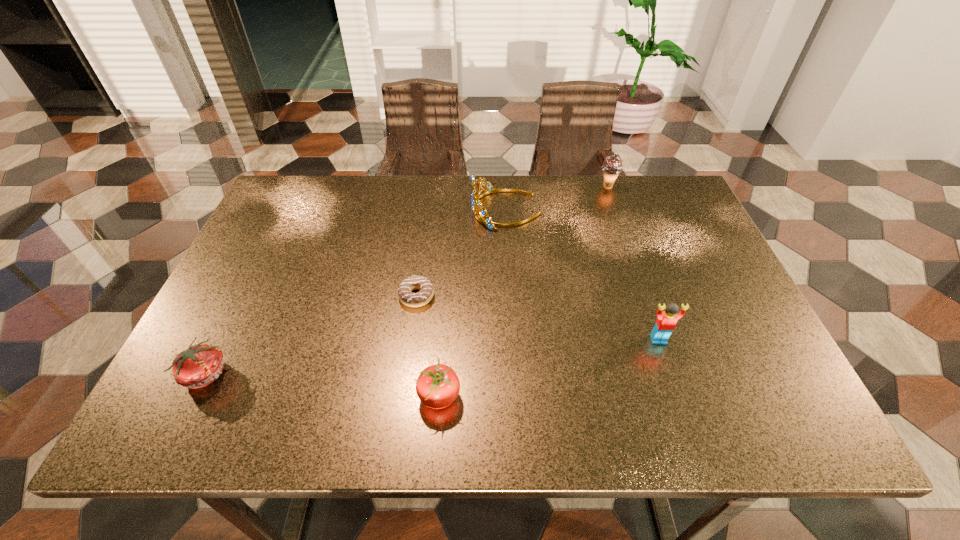
This screenshot has width=960, height=540. Find the location of `free spot located on the front-facing side of the fourth object from left to right`. free spot located on the front-facing side of the fourth object from left to right is located at coordinates (364, 210).

Find the location of a particular element. free location located 0.100m on the face of the Lego is located at coordinates (675, 386).

You are a GUI agent. You are given a task and a screenshot of the screen. Output one action in this format:
    pyautogui.click(x=<x>, y=<y>)
    Task: Click on the vacant point located on the right of the right tomato
    Image resolution: width=960 pixels, height=540 pixels.
    Given the screenshot: What is the action you would take?
    pyautogui.click(x=619, y=396)

The width and height of the screenshot is (960, 540). What are the coordinates of `free region located on the back of the leftmost object` in the screenshot? It's located at (248, 289).

I want to click on free space located on the front of the doughnut, so click(x=405, y=379).

Locate an element on the screen. icecream that is at the far edge is located at coordinates (612, 166).

Where is `tiara present at the far edge`? This screenshot has height=540, width=960. tiara present at the far edge is located at coordinates (482, 217).

Find the location of a particular element. This screenshot has width=960, height=540. object situated at the left edge is located at coordinates (196, 367).

You are a GUI agent. You are given a task and a screenshot of the screen. Output one action in this format:
    pyautogui.click(x=<x>, y=<y>)
    Task: Click on the object that is positioned at the near left corner
    
    Given the screenshot: What is the action you would take?
    196,367

The height and width of the screenshot is (540, 960). I want to click on vacant area at the far edge, so point(387,179).